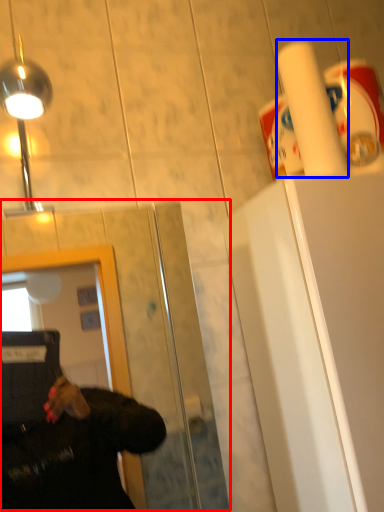
Question: Among these objects, which one is nearest to the camera, glass door (highlighted by a red box) or paper towel (highlighted by a blue box)?

Choices:
 (A) glass door
 (B) paper towel

Answer: (A)